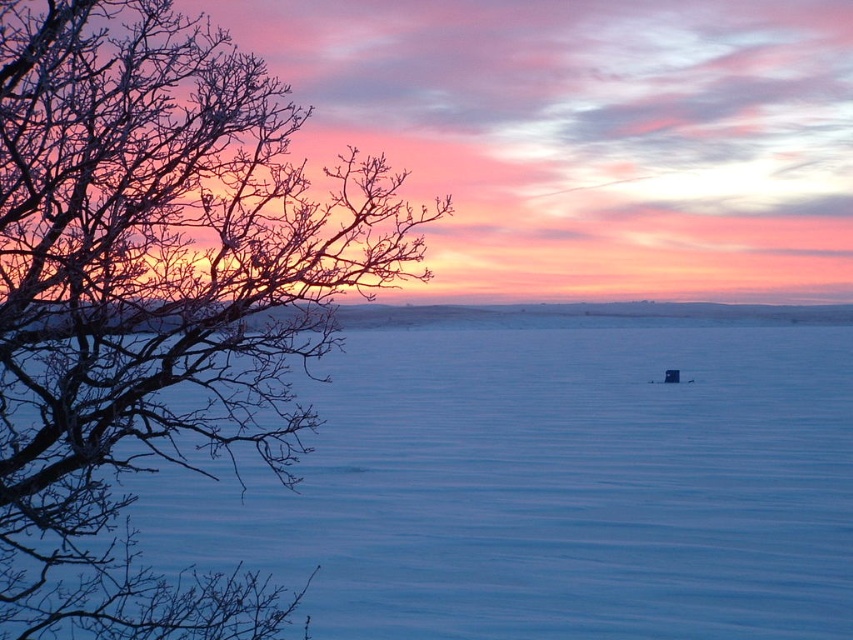
Which is more to the right, smooth ice at center or bare branches at left?

smooth ice at center is more to the right.

Where is `smooth ice at center`? The width and height of the screenshot is (853, 640). smooth ice at center is located at coordinates (550, 484).

At what (x,y) coordinates should I click in order to perform the action: click on smooth ice at center. Please return your answer as a coordinate pair (x, y). Looking at the image, I should click on (x=550, y=484).